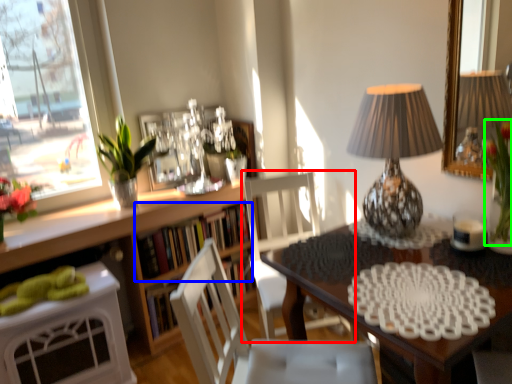
Question: Which object is the closest to the chair (highlighted by a red box)? Choose among these: book (highlighted by a blue box) or floral arrangement (highlighted by a green box).

Choices:
 (A) book
 (B) floral arrangement

Answer: (A)